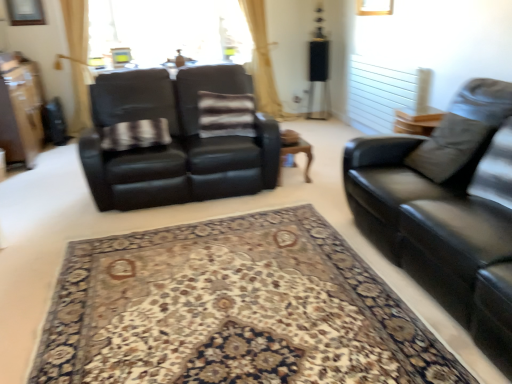
Question: Considering the relative sizes of transparent glass window screen at upper center and striped fabric pillow at center in the image provided, is transparent glass window screen at upper center smaller than striped fabric pillow at center?

Choices:
 (A) no
 (B) yes

Answer: (A)

Question: Considering the relative sizes of transparent glass window screen at upper center and striped fabric pillow at center in the image provided, is transparent glass window screen at upper center shorter than striped fabric pillow at center?

Choices:
 (A) no
 (B) yes

Answer: (A)

Question: Can you confirm if transparent glass window screen at upper center is positioned to the left of striped fabric pillow at center?

Choices:
 (A) yes
 (B) no

Answer: (A)

Question: Does transparent glass window screen at upper center come in front of striped fabric pillow at center?

Choices:
 (A) yes
 (B) no

Answer: (B)

Question: Is transparent glass window screen at upper center oriented away from striped fabric pillow at center?

Choices:
 (A) no
 (B) yes

Answer: (A)

Question: Considering the relative sizes of transparent glass window screen at upper center and striped fabric pillow at center in the image provided, is transparent glass window screen at upper center thinner than striped fabric pillow at center?

Choices:
 (A) no
 (B) yes

Answer: (B)

Question: From a real-world perspective, does striped fabric pillow at center stand above black leather couch at left, the second studio couch from the right?

Choices:
 (A) yes
 (B) no

Answer: (A)

Question: Can you confirm if striped fabric pillow at center is positioned to the right of black leather couch at left, acting as the second studio couch starting from the front?

Choices:
 (A) no
 (B) yes

Answer: (B)

Question: Can you confirm if striped fabric pillow at center is thinner than black leather couch at left, the second studio couch from the right?

Choices:
 (A) yes
 (B) no

Answer: (A)

Question: From the image's perspective, is striped fabric pillow at center above black leather couch at left, which is counted as the 1th studio couch, starting from the back?

Choices:
 (A) yes
 (B) no

Answer: (A)

Question: Is striped fabric pillow at center positioned with its back to black leather couch at left, the second studio couch from the right?

Choices:
 (A) no
 (B) yes

Answer: (B)

Question: Considering the relative sizes of striped fabric pillow at center and black leather couch at left, the second studio couch from the right, in the image provided, is striped fabric pillow at center wider than black leather couch at left, the second studio couch from the right,?

Choices:
 (A) no
 (B) yes

Answer: (A)

Question: Is black leather couch at left, acting as the second studio couch starting from the front, closer to the viewer compared to wooden coffee table at center?

Choices:
 (A) yes
 (B) no

Answer: (A)